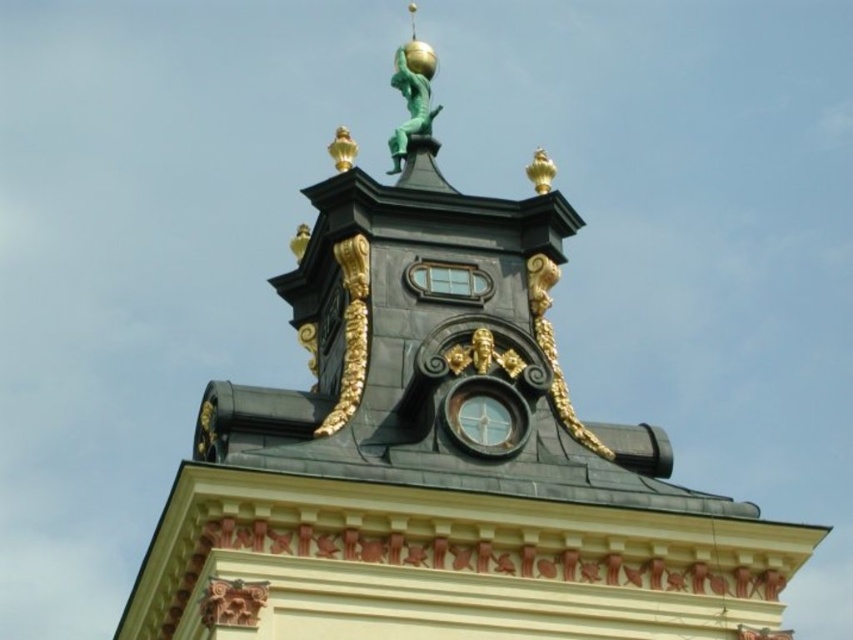
Who is shorter, matte black clock at center or green patina figure at top?

With less height is matte black clock at center.

The image size is (853, 640). Describe the element at coordinates (486, 417) in the screenshot. I see `matte black clock at center` at that location.

Who is more distant from viewer, (468,381) or (392,168)?

The point (392,168) is behind.

The image size is (853, 640). I want to click on matte black clock at center, so click(486, 417).

The width and height of the screenshot is (853, 640). Describe the element at coordinates (351, 332) in the screenshot. I see `gold metallic ornament at upper center` at that location.

Does gold metallic ornament at upper center appear on the right side of green patina figure at top?

No, gold metallic ornament at upper center is not to the right of green patina figure at top.

Identify the location of gold metallic ornament at upper center. This screenshot has width=853, height=640. (351, 332).

Locate an element on the screen. This screenshot has width=853, height=640. gold metallic ornament at upper center is located at coordinates (351, 332).

Which is below, matte black clock at center or gold metallic ornament at upper center?

matte black clock at center is lower down.

Which of these two, matte black clock at center or gold metallic ornament at upper center, stands shorter?

With less height is matte black clock at center.

Between point (486, 432) and point (349, 262), which one is positioned behind?

Positioned behind is point (349, 262).

Find the location of `matte black clock at center`. matte black clock at center is located at coordinates (486, 417).